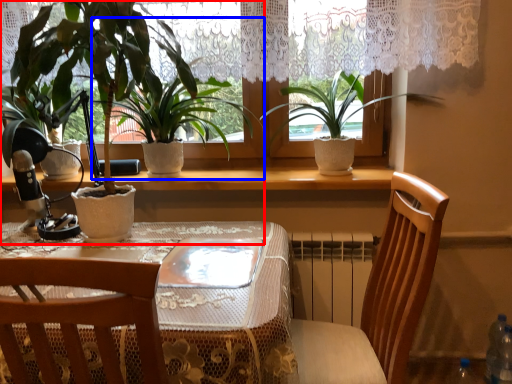
Question: Among these objects, which one is farthest to the camera, houseplant (highlighted by a red box) or houseplant (highlighted by a blue box)?

Choices:
 (A) houseplant
 (B) houseplant

Answer: (B)